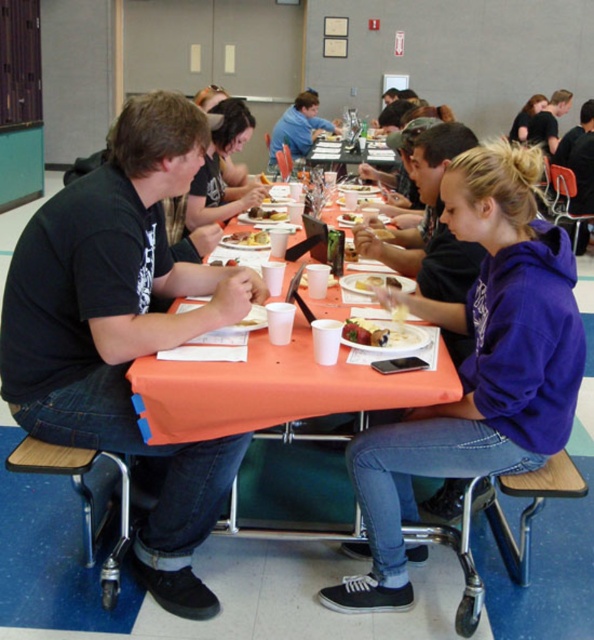
You are a server in a cafeteria. You have to place a new cup on the table without knocking over the yellowish matte plate at center or the smooth brown bread at center. Which object should you avoid placing the cup near because it is taller?

The smooth brown bread at center is taller than the yellowish matte plate at center, so you should avoid placing the cup near the smooth brown bread at center to prevent it from being knocked over.

You are taking a photo of the yellowish matte plate at center using a camera. If the camera is positioned at your eye level, which is 5.5 feet high, and the plate is on a table that is 2.8 feet tall, will the camera be able to capture the plate in the photo without any obstruction?

The yellowish matte plate at center and camera are 7.45 feet apart from each other. Since the plate is on a table that is 2.8 feet tall and the camera is at 5.5 feet height, the camera is positioned higher than the plate. The vertical distance between the camera and the plate is 5.5 feet minus 2.8 feet equals 2.7 feet. The horizontal distance is 7.45 feet. The camera can capture the plate as long as there are no obstructions between them. Since the scene description mentions the plate is at center and no ob